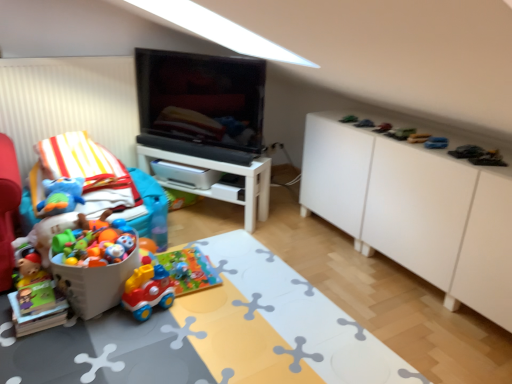
Locate an element on the screen. free location to the left of plastic toy car at upper right, positioned as the first toy in right-to-left order is located at coordinates (454, 155).